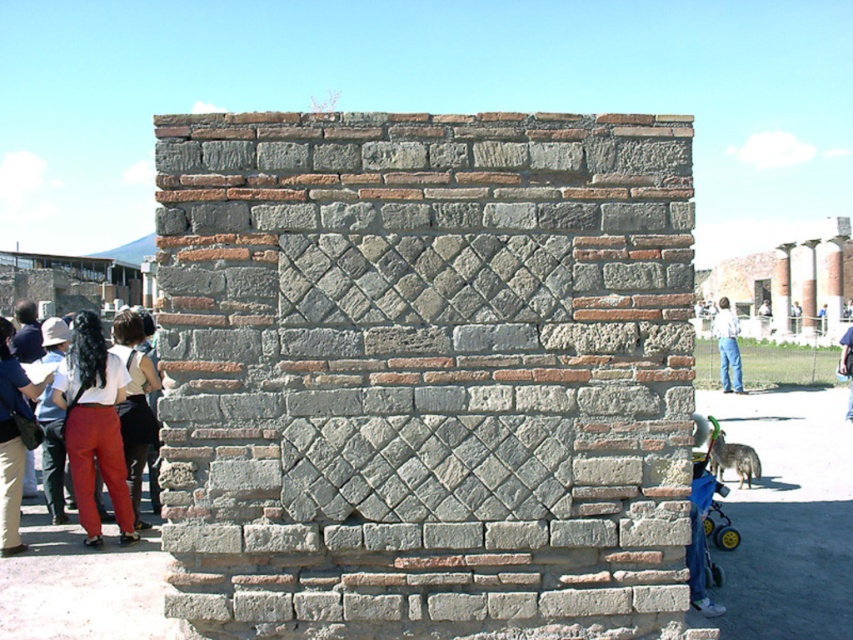
You are a tourist standing in front of the gray stone wall at center and the matte black hair at left. Which object is larger in the image?

The matte black hair at left is larger than the gray stone wall at center in the image.

You are a tour guide explaining the historical stone wall to visitors. You notice a tourist wearing a matte black shirt at left and jeans at right. From the tourist standing near the wall, which piece of clothing is closer to the wall?

The matte black shirt at left is closer to the wall because it is positioned below the jeans at right, which places it lower and nearer to the wall.